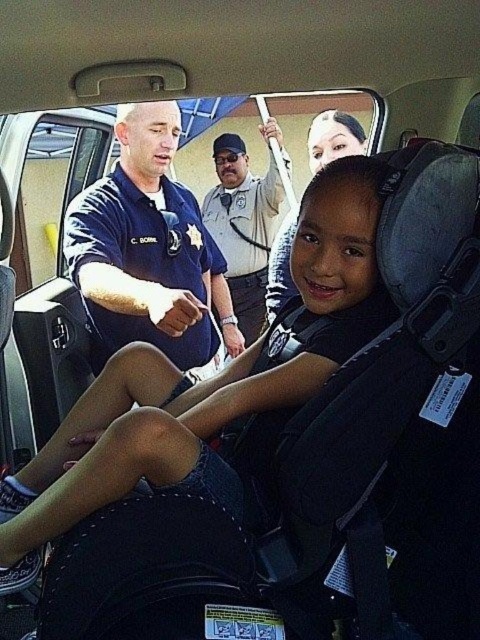
You are a passenger in the police car and need to locate the blue uniform shirt at upper left. What are the coordinates where you should look?

The coordinates for the blue uniform shirt at upper left are at point (143, 244).

Based on the photo, you are a police officer trying to determine which uniform has a wider torso based on the image. Which officer, the one in the blue uniform shirt at upper left or the light brown uniform at center, has a wider torso?

The blue uniform shirt at upper left has a greater width than the light brown uniform at center, indicating a wider torso.